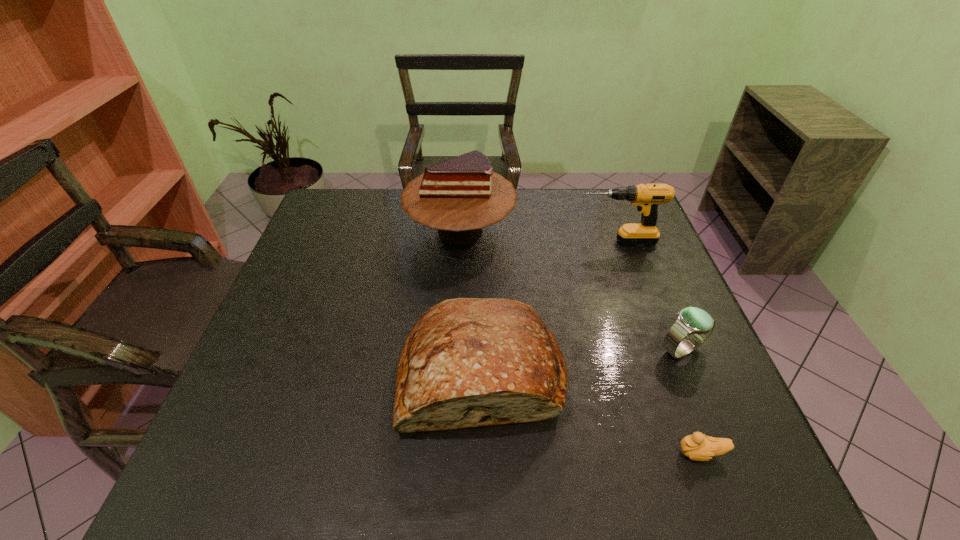
The height and width of the screenshot is (540, 960). In order to click on object at the near right corner in this screenshot , I will do `click(697, 447)`.

Identify the location of vacant area at the far edge of the desktop. (540, 216).

I want to click on vacant space at the near edge, so click(x=346, y=488).

Where is `free space at the left edge of the desktop`? Image resolution: width=960 pixels, height=540 pixels. free space at the left edge of the desktop is located at coordinates (288, 291).

You are a GUI agent. You are given a task and a screenshot of the screen. Output one action in this format:
    pyautogui.click(x=<x>, y=<y>)
    Task: Click on the vacant space at the far left corner of the desktop
    This screenshot has height=540, width=960.
    Given the screenshot: What is the action you would take?
    pyautogui.click(x=367, y=210)

At what (x,y) coordinates should I click in order to perform the action: click on free space between the nearest object and the fourth tallest object. Please return your answer as a coordinate pair (x, y). The width and height of the screenshot is (960, 540). Looking at the image, I should click on (691, 402).

Where is `free space between the cake and the watch`? Image resolution: width=960 pixels, height=540 pixels. free space between the cake and the watch is located at coordinates (571, 291).

Identify the location of free space between the watch and the drill. Image resolution: width=960 pixels, height=540 pixels. (649, 296).

Where is `blank region between the bread and the nearest object`? The image size is (960, 540). blank region between the bread and the nearest object is located at coordinates (591, 413).

The image size is (960, 540). Find the location of `vacant area that lies between the drill and the shortest object`. vacant area that lies between the drill and the shortest object is located at coordinates (659, 348).